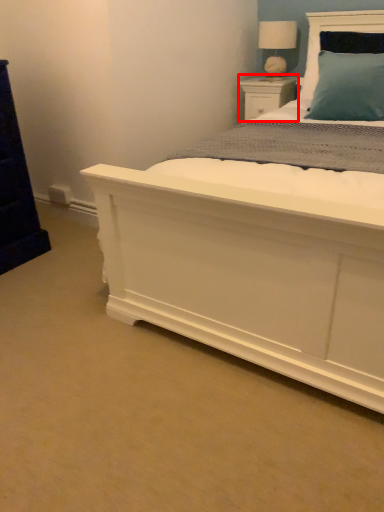
Question: From the image's perspective, what is the correct spatial positioning of nightstand (annotated by the red box) in reference to table lamp?

Choices:
 (A) below
 (B) above

Answer: (A)